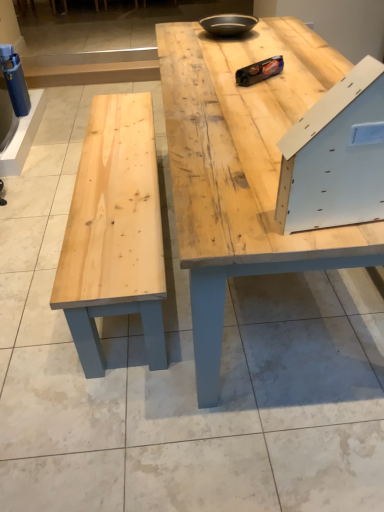
Image resolution: width=384 pixels, height=512 pixels. I want to click on vacant space underneath matte black bowl at upper center (from a real-world perspective), so click(x=233, y=33).